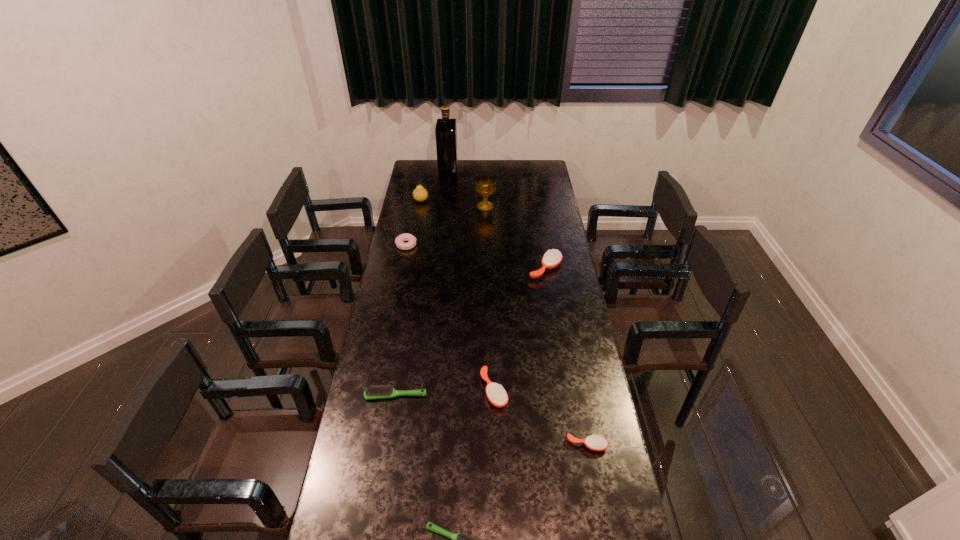
Where is `vacant space located 0.310m on the front of the leftmost hairbrush`? This screenshot has height=540, width=960. vacant space located 0.310m on the front of the leftmost hairbrush is located at coordinates (380, 490).

The height and width of the screenshot is (540, 960). I want to click on vacant space located on the front of the smallest orange hairbrush, so click(x=600, y=519).

Find the location of a particular element. object present at the far edge is located at coordinates (446, 129).

Locate an element on the screen. The image size is (960, 540). pear at the left edge is located at coordinates [x=420, y=194].

At what (x,y) coordinates should I click in order to perform the action: click on doughnut located in the left edge section of the desktop. Please return your answer as a coordinate pair (x, y). Looking at the image, I should click on (399, 241).

The height and width of the screenshot is (540, 960). Identify the location of hairbrush present at the left edge. pyautogui.click(x=373, y=392).

In the image, there is a desktop. At what (x,y) coordinates should I click in order to perform the action: click on vacant area at the far edge. Please return your answer as a coordinate pair (x, y). Looking at the image, I should click on (516, 166).

Where is `vacant area at the left edge of the desktop`? vacant area at the left edge of the desktop is located at coordinates click(401, 208).

The width and height of the screenshot is (960, 540). I want to click on free point at the right edge, so click(x=565, y=262).

In order to click on free space that is in between the farther light hairbrush and the farthest hairbrush in this screenshot , I will do `click(470, 332)`.